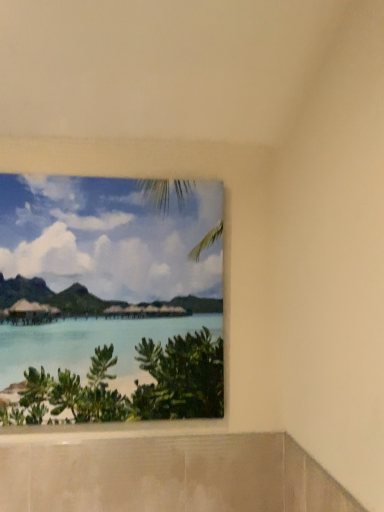
Question: Should I look upward or downward to see matte tropical beach scene at upper left?

Choices:
 (A) up
 (B) down

Answer: (B)